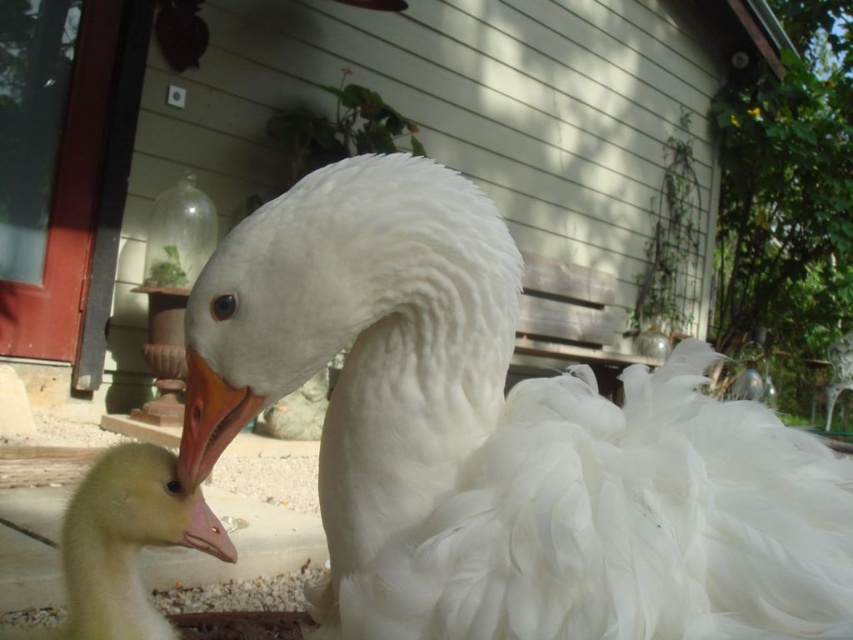
Locate an element on the screen. The image size is (853, 640). orange matte beak at center is located at coordinates (209, 419).

Can you confirm if orange matte beak at center is shorter than pink matte beak at center?

In fact, orange matte beak at center may be taller than pink matte beak at center.

This screenshot has height=640, width=853. Identify the location of orange matte beak at center. (209, 419).

Identify the location of orange matte beak at center. This screenshot has width=853, height=640. (209, 419).

Who is higher up, white fluffy goose at center or orange matte beak at center?

orange matte beak at center is higher up.

Does white fluffy goose at center come behind orange matte beak at center?

No, white fluffy goose at center is in front of orange matte beak at center.

Who is more distant from viewer, (350, 177) or (192, 396)?

The point (192, 396) is more distant.

Image resolution: width=853 pixels, height=640 pixels. In order to click on white fluffy goose at center in this screenshot , I will do `click(509, 438)`.

Can you confirm if white fluffy goose at center is positioned to the left of pink matte beak at center?

Incorrect, white fluffy goose at center is not on the left side of pink matte beak at center.

Between white fluffy goose at center and pink matte beak at center, which one appears on the right side from the viewer's perspective?

white fluffy goose at center is more to the right.

The height and width of the screenshot is (640, 853). In order to click on white fluffy goose at center in this screenshot , I will do `click(509, 438)`.

This screenshot has height=640, width=853. I want to click on white fluffy goose at center, so click(x=509, y=438).